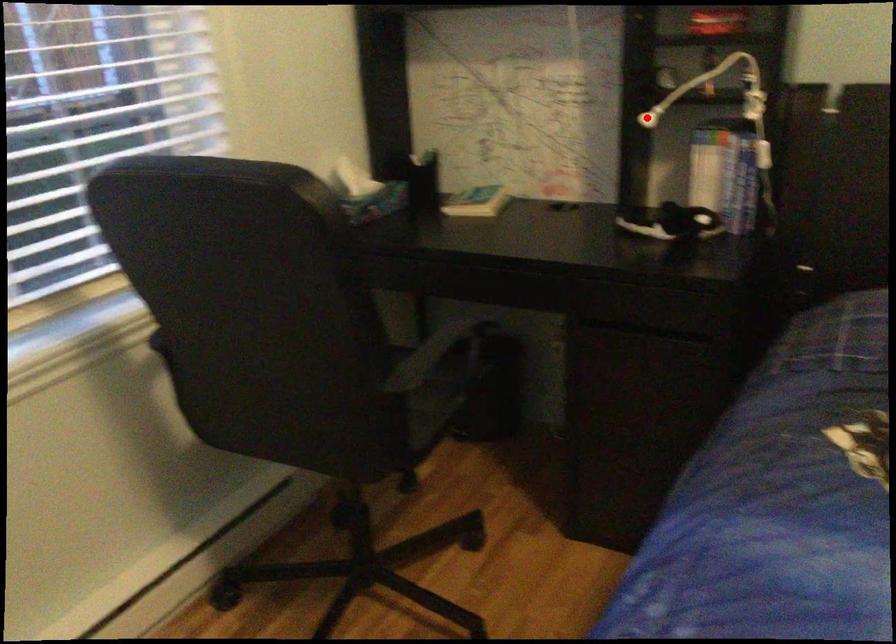
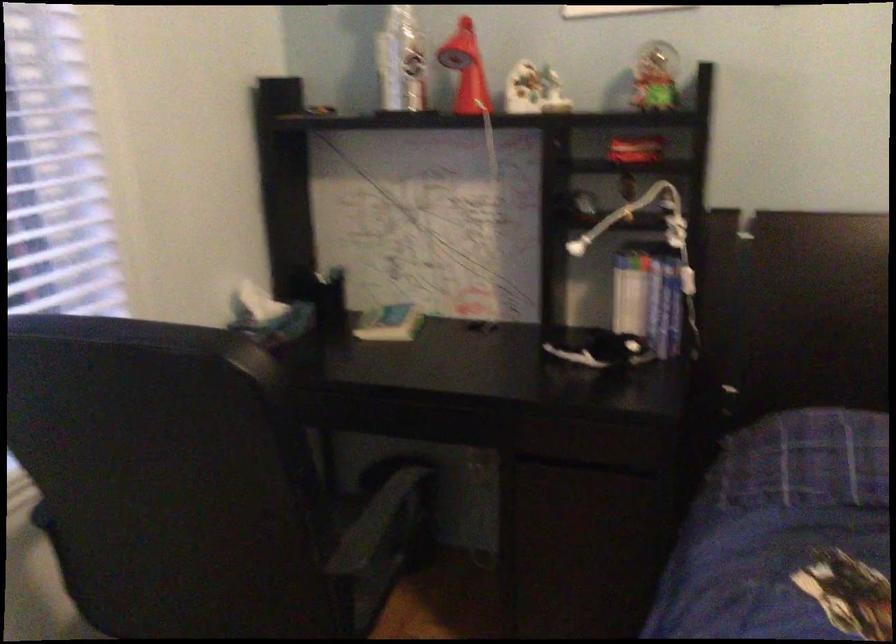
In the second image, find the point that corresponds to the highlighted location in the first image.

(576, 247)